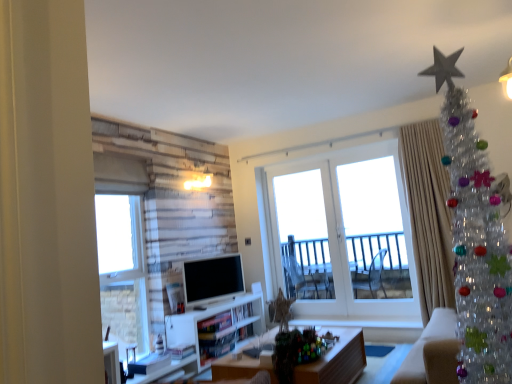
Question: Does clear glass window at left, which is counted as the 2th window, starting from the right, have a greater height compared to wooden desk at center?

Choices:
 (A) yes
 (B) no

Answer: (A)

Question: Does clear glass window at left, which is counted as the 2th window, starting from the right, appear on the left side of wooden desk at center?

Choices:
 (A) no
 (B) yes

Answer: (B)

Question: From the image's perspective, is clear glass window at left, which is counted as the 2th window, starting from the right, above wooden desk at center?

Choices:
 (A) no
 (B) yes

Answer: (B)

Question: Is the depth of clear glass window at left, the second window viewed from the back, less than that of wooden desk at center?

Choices:
 (A) yes
 (B) no

Answer: (B)

Question: Would you say clear glass window at left, the second window viewed from the back, contains wooden desk at center?

Choices:
 (A) yes
 (B) no

Answer: (B)

Question: Are clear glass window at left, the second window viewed from the back, and wooden desk at center far apart?

Choices:
 (A) no
 (B) yes

Answer: (B)

Question: Is clear glass window at left, the second window viewed from the back, positioned with its back to clear plastic christmas tree at upper right?

Choices:
 (A) no
 (B) yes

Answer: (A)

Question: Can you confirm if clear glass window at left, the 1th window from the left, is thinner than clear plastic christmas tree at upper right?

Choices:
 (A) no
 (B) yes

Answer: (B)

Question: Does clear glass window at left, which appears as the 1th window when viewed from the front, turn towards clear plastic christmas tree at upper right?

Choices:
 (A) yes
 (B) no

Answer: (A)

Question: From the image's perspective, is clear glass window at left, which is counted as the 2th window, starting from the right, on clear plastic christmas tree at upper right?

Choices:
 (A) yes
 (B) no

Answer: (B)

Question: Does clear glass window at left, the 1th window from the left, have a greater width compared to clear plastic christmas tree at upper right?

Choices:
 (A) no
 (B) yes

Answer: (A)

Question: Considering the relative sizes of clear glass window at left, which is counted as the 2th window, starting from the right, and clear plastic christmas tree at upper right in the image provided, is clear glass window at left, which is counted as the 2th window, starting from the right, bigger than clear plastic christmas tree at upper right?

Choices:
 (A) no
 (B) yes

Answer: (A)

Question: Considering the relative sizes of white glass door at center, the second window when ordered from left to right, and clear plastic christmas tree at upper right in the image provided, is white glass door at center, the second window when ordered from left to right, bigger than clear plastic christmas tree at upper right?

Choices:
 (A) yes
 (B) no

Answer: (B)